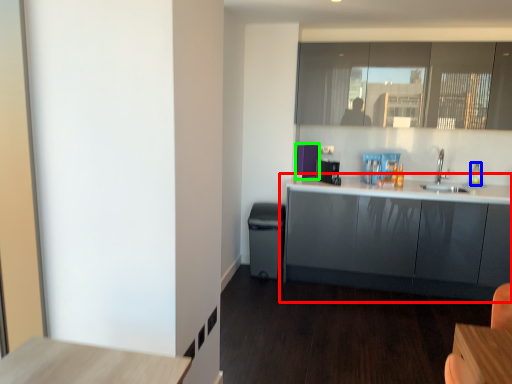
Question: Based on their relative distances, which object is farther from cabinetry (highlighted by a red box)? Choose from bottle (highlighted by a blue box) and appliance (highlighted by a green box).

Choices:
 (A) bottle
 (B) appliance

Answer: (A)